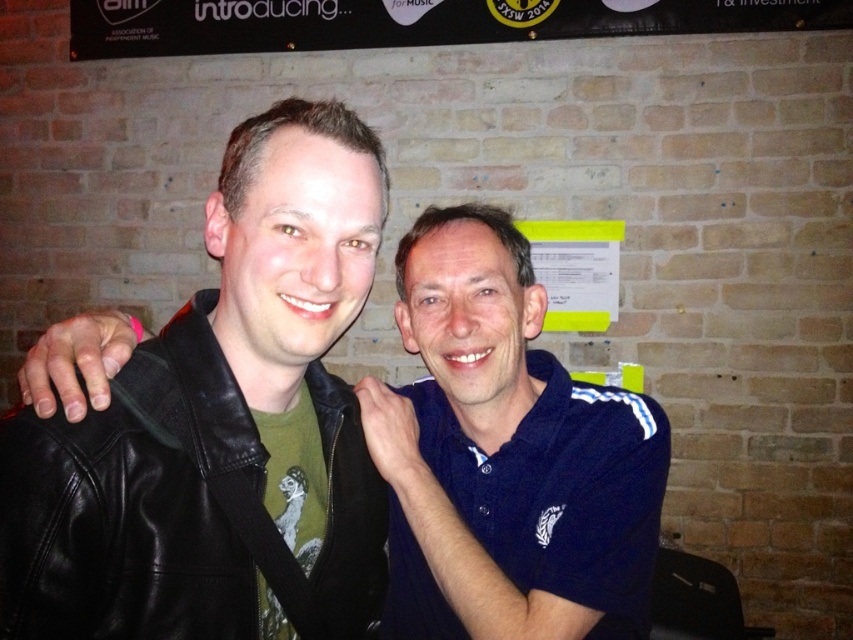
You are a photographer at the SXSW 2014 event. You need to capture a photo of both black leather jacket at center and black leather jacket at left. Which one should you zoom in on to focus on the details of the jacket without cropping the other jacket out of the frame?

The black leather jacket at center occupies less space than the black leather jacket at left, so you should zoom in on the black leather jacket at left to ensure both jackets remain in frame while focusing on its details.

You are a photographer trying to capture the black leather jacket at center in your shot. Based on the coordinates provided, where should you aim your camera to ensure the jacket is centered in the frame?

The black leather jacket at center is located at coordinates point (219, 426), so aim your camera at that point to center it in the frame.